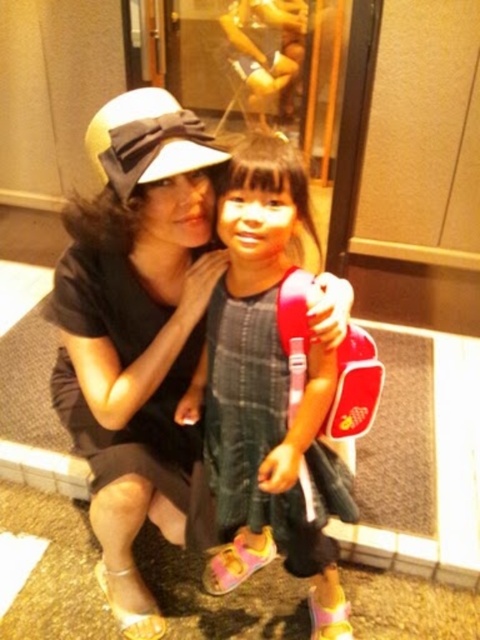
Question: Does matte black hat at upper left appear on the left side of plaid fabric dress at center?

Choices:
 (A) yes
 (B) no

Answer: (A)

Question: Observing the image, what is the correct spatial positioning of matte black hat at upper left in reference to plaid fabric dress at center?

Choices:
 (A) left
 (B) right

Answer: (A)

Question: Which of the following is the farthest from the observer?

Choices:
 (A) (233, 259)
 (B) (74, 328)

Answer: (B)

Question: Among these points, which one is nearest to the camera?

Choices:
 (A) (324, 577)
 (B) (139, 605)

Answer: (A)

Question: Is matte black hat at upper left below plaid fabric dress at center?

Choices:
 (A) yes
 (B) no

Answer: (B)

Question: Which of the following is the closest to the observer?

Choices:
 (A) (115, 176)
 (B) (252, 540)

Answer: (A)